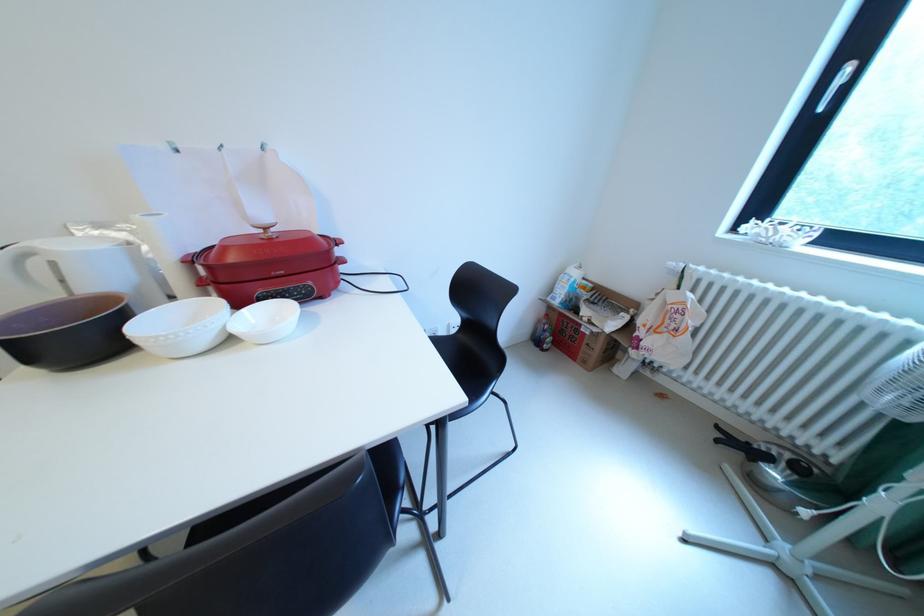
You are a GUI agent. You are given a task and a screenshot of the screen. Output one action in this format:
    pyautogui.click(x=<x>, y=<y>)
    Task: Click on the pot lid handle
    The image size is (924, 616).
    Given the screenshot: What is the action you would take?
    pyautogui.click(x=270, y=265)